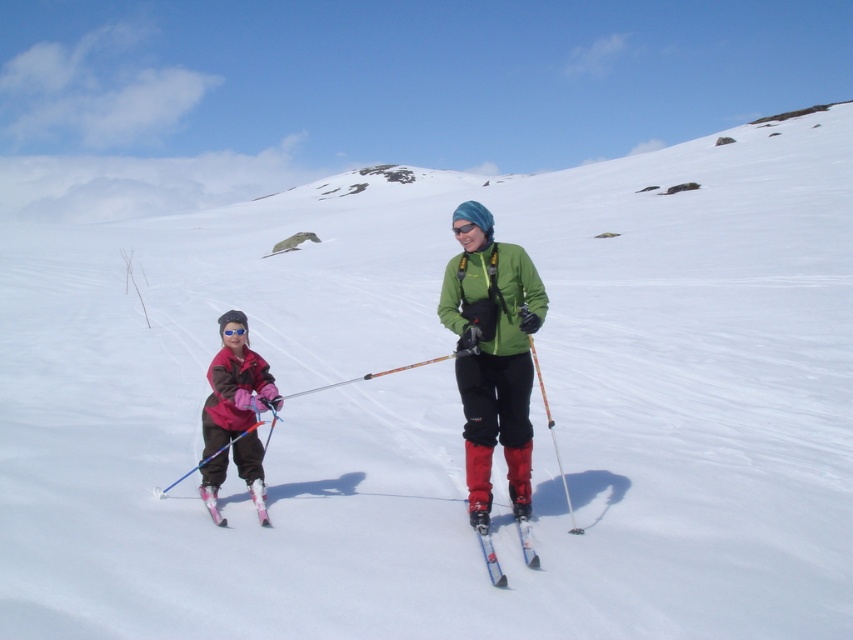
You are a photographer trying to capture a photo of both the matte pink ski suit at left and the pink glossy ski at lower left. Since you want to show both objects clearly in the frame, which one should you focus on first to ensure proper focus?

The matte pink ski suit at left is taller than the pink glossy ski at lower left, so you should focus on the matte pink ski suit at left first to ensure proper focus since it is larger in the frame.

You are a photographer standing at the edge of the snowfield. You want to take a photo that includes both the green matte jacket at center and the pink glossy ski at lower left. Based on their heights, which object will appear taller in the photo?

The green matte jacket at center will appear taller in the photo because it has a greater height compared to the pink glossy ski at lower left.